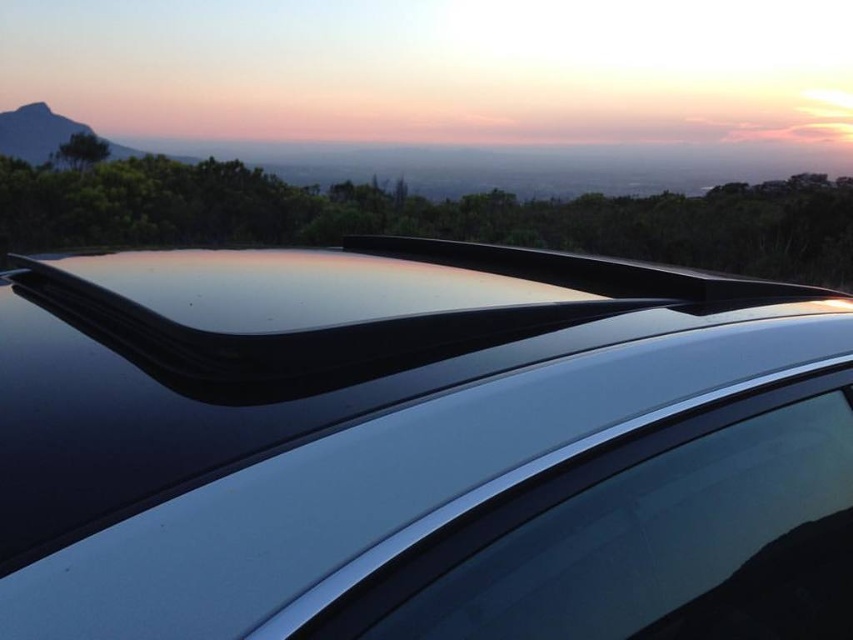
Question: Is glossy black roof rack at upper center to the left of satin silver glass at center from the viewer's perspective?

Choices:
 (A) no
 (B) yes

Answer: (B)

Question: Is glossy black roof rack at upper center in front of satin silver glass at center?

Choices:
 (A) no
 (B) yes

Answer: (B)

Question: Which point is farther from the camera taking this photo?

Choices:
 (A) (85, 125)
 (B) (788, 496)
 (C) (473, 628)

Answer: (A)

Question: Which point is closer to the camera?

Choices:
 (A) satin silver glass at center
 (B) matte black rock at upper left
 (C) glossy black roof rack at upper center

Answer: (C)

Question: Based on their relative distances, which object is farther from the matte black rock at upper left?

Choices:
 (A) satin silver glass at center
 (B) glossy black roof rack at upper center

Answer: (B)

Question: Is glossy black roof rack at upper center positioned behind matte black rock at upper left?

Choices:
 (A) no
 (B) yes

Answer: (A)